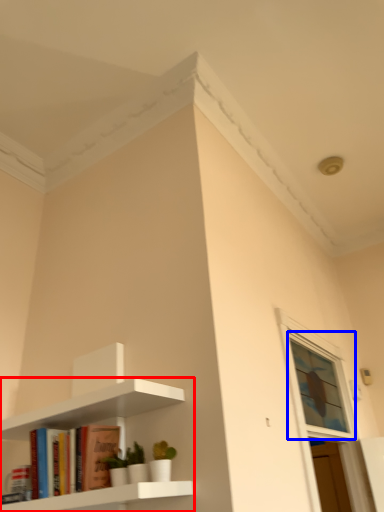
Question: Which object appears closest to the camera in this image, shelf (highlighted by a red box) or window (highlighted by a blue box)?

Choices:
 (A) shelf
 (B) window

Answer: (A)